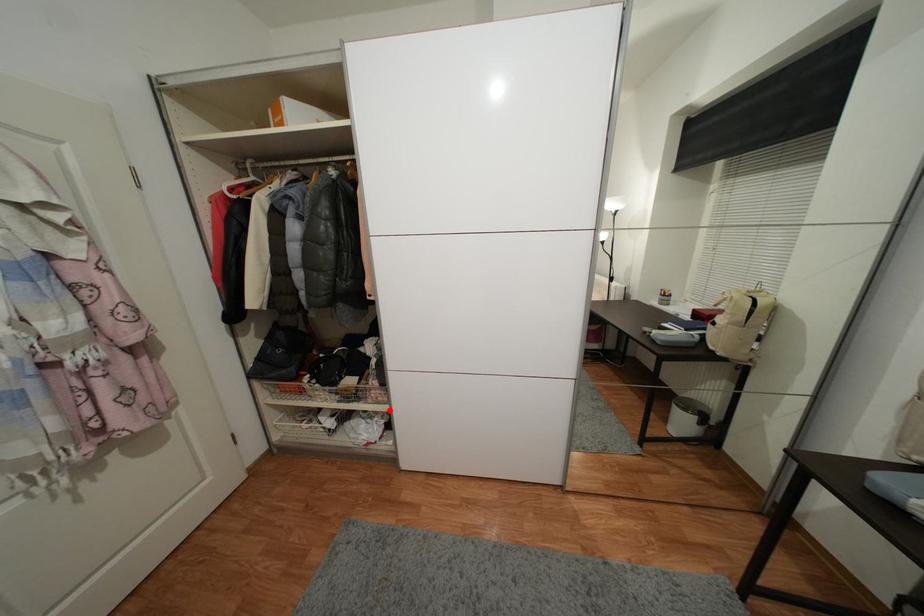
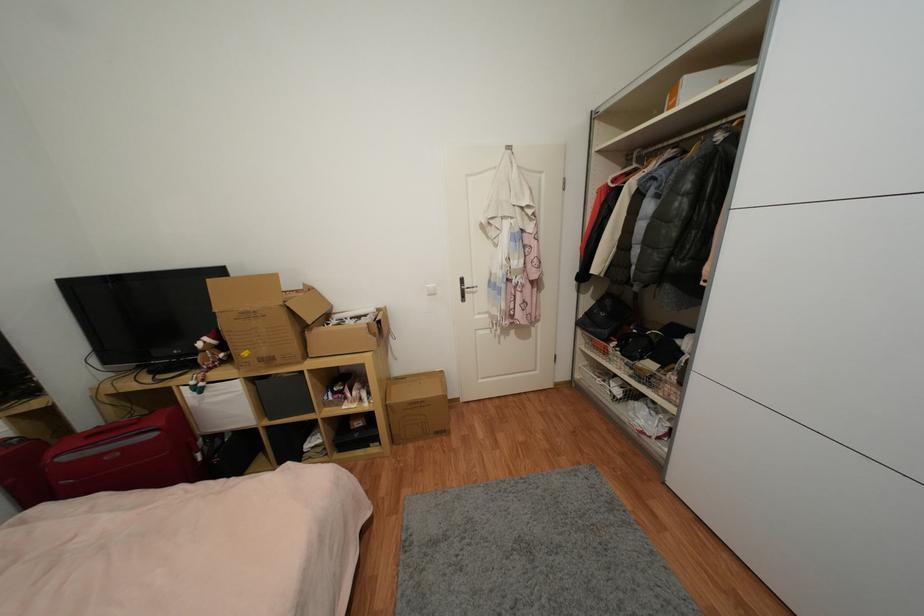
Question: A red point is marked in image1. In image2, is the corresponding 3D point closer to the camera or farther? Reply with the corresponding letter.

Choices:
 (A) The corresponding 3D point is closer.
 (B) The corresponding 3D point is farther.

Answer: (A)